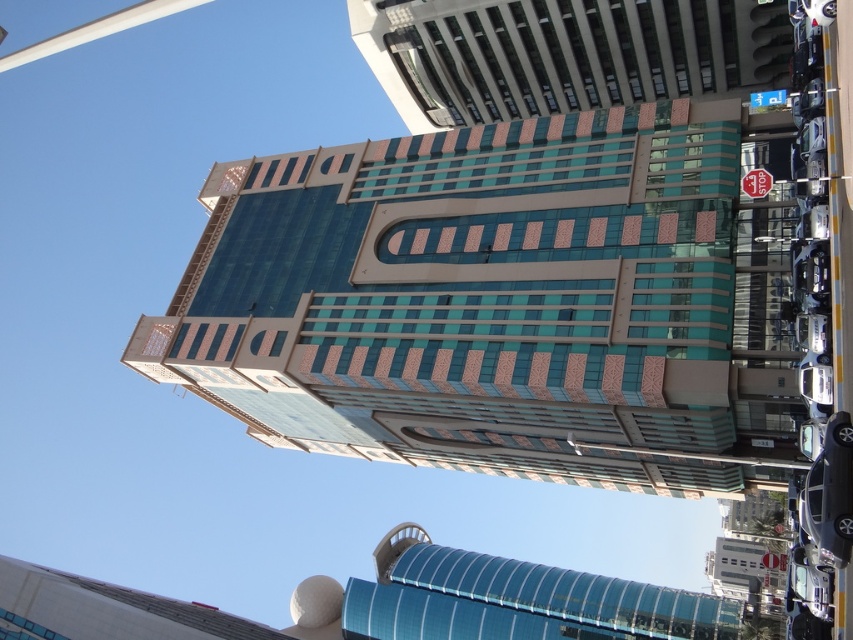
You are a drone operator who needs to deliver a package from the teal glass building at center to the red plastic stop sign at upper right. What is the minimum distance you need to fly between the two locations?

The minimum distance you need to fly between the teal glass building at center and the red plastic stop sign at upper right is 22.65 meters.

You are a city planner assessing the urban layout. You notice the teal glass building at center and the red plastic stop sign at upper right. Which object occupies more space in the scene?

The teal glass building at center has a larger size compared to the red plastic stop sign at upper right, so it occupies more space in the scene.